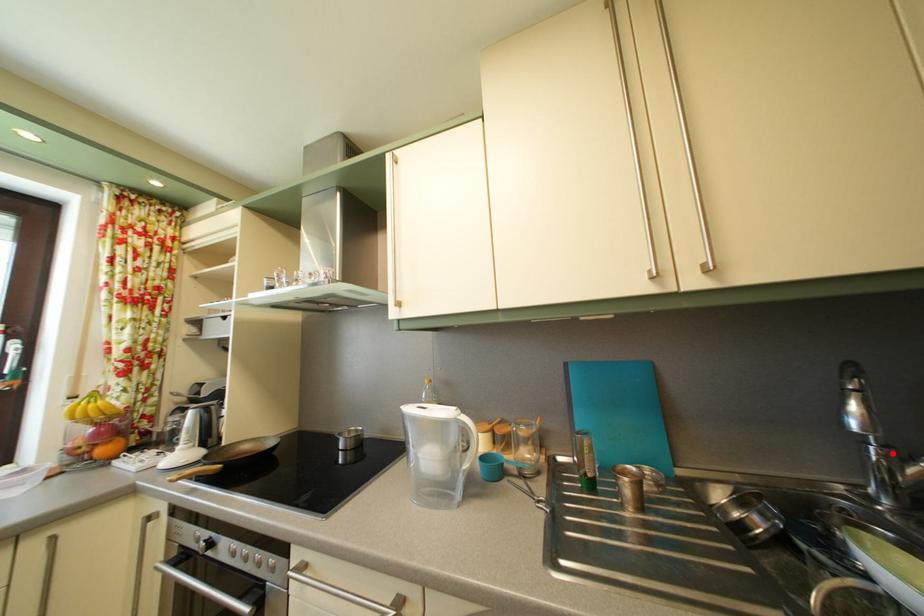
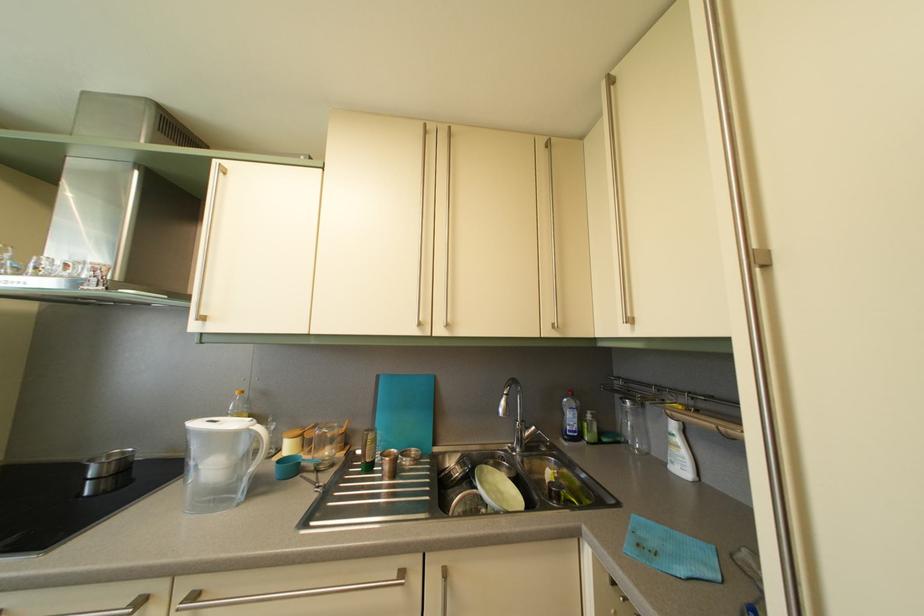
Question: I am providing you with two images of the same scene from different viewpoints. Given a red point in image1, look at the same physical point in image2. Is it:

Choices:
 (A) Closer to the viewpoint
 (B) Farther from the viewpoint

Answer: (B)